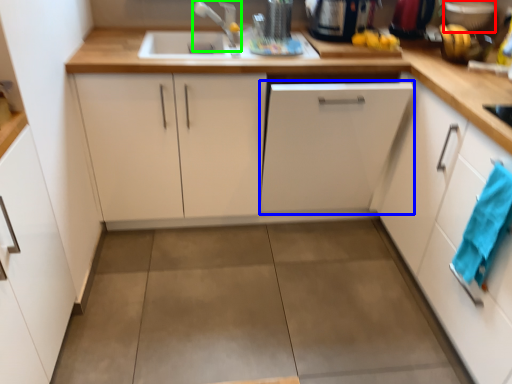
Question: Considering the real-world distances, which object is closest to appliance (highlighted by a red box)? cabinetry (highlighted by a blue box) or faucet (highlighted by a green box).

Choices:
 (A) cabinetry
 (B) faucet

Answer: (A)